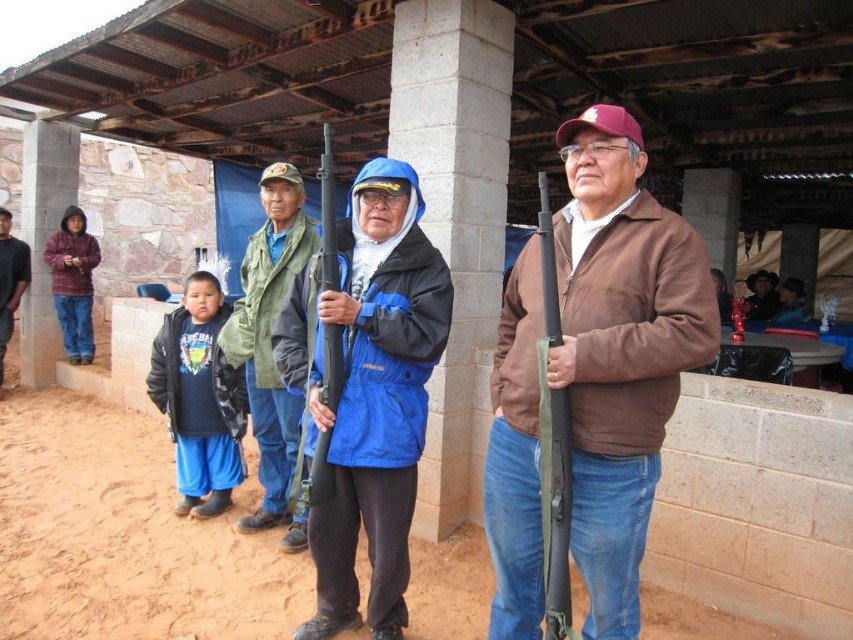
You are a photographer setting up a tripod to take a group photo of the people under the shelter. You notice the matte black shotgun at right and the plaid hoodie at left in your frame. Which object should you adjust your camera angle to avoid blocking the other object?

The matte black shotgun at right is positioned under the plaid hoodie at left, so adjusting the camera angle to avoid the shotgun would prevent it from blocking the view of the plaid hoodie at left.

You are a photographer trying to capture a clear shot of both the plaid hoodie at left and the black matte shotgun at center. Since you want both objects to be visible in the frame, which object should you focus on first to ensure depth of field?

The plaid hoodie at left is taller than the black matte shotgun at center, so focusing on the plaid hoodie at left first will help ensure both are in focus due to its larger size.

Consider the image. You are a photographer trying to capture a candid shot of the two men under the shelter. You notice the matte black shotgun at right and the plaid hoodie at left. Which object is positioned farther to the east in the image?

The matte black shotgun at right is to the right of the plaid hoodie at left, so the matte black shotgun at right is positioned farther to the east in the image.